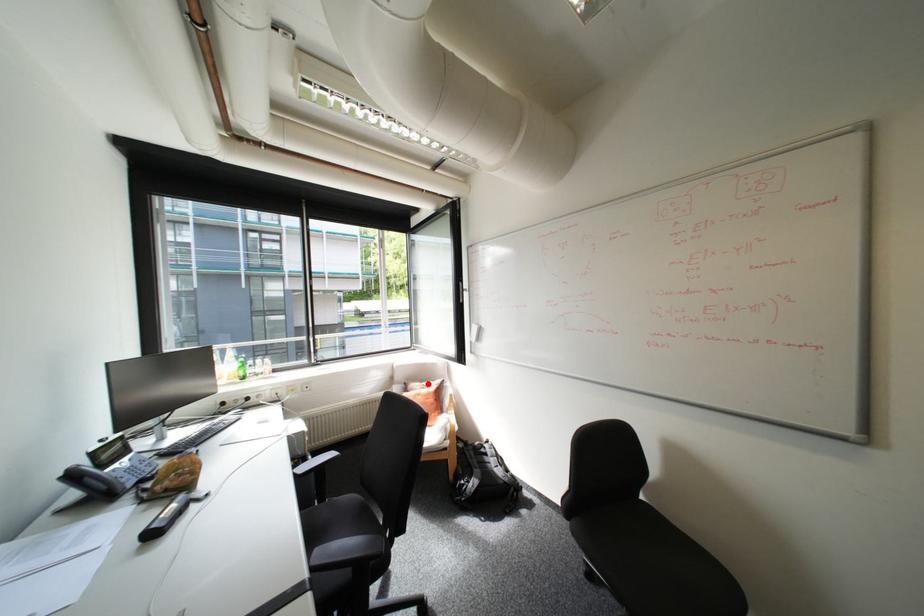
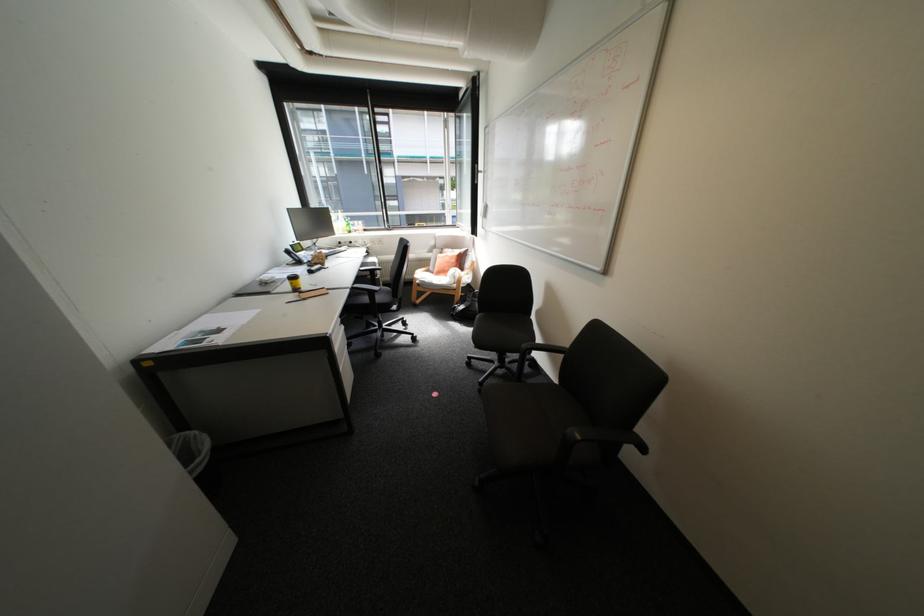
Question: I am providing you with two images of the same scene from different viewpoints. A red point is shown in image1. For the corresponding object point in image2, is it positioned nearer or farther from the camera?

Choices:
 (A) Nearer
 (B) Farther

Answer: (A)